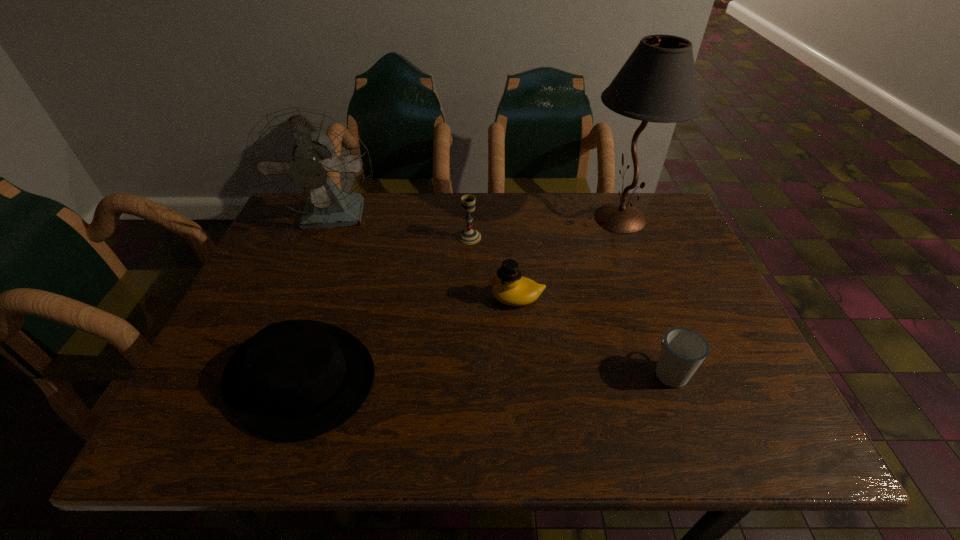
Find the location of `fan that is positioned at the far edge`. fan that is positioned at the far edge is located at coordinates (307, 160).

Find the location of `chalice that is at the far edge`. chalice that is at the far edge is located at coordinates (468, 236).

You are a GUI agent. You are given a task and a screenshot of the screen. Output one action in this format:
    pyautogui.click(x=<x>, y=<y>)
    Task: Click on the object that is at the near edge
    The height and width of the screenshot is (540, 960).
    Given the screenshot: What is the action you would take?
    pyautogui.click(x=295, y=379)

Image resolution: width=960 pixels, height=540 pixels. Identify the location of fan that is at the left edge. (307, 160).

Identify the location of fedora at the left edge. (295, 379).

Locate an element on the screen. The width and height of the screenshot is (960, 540). table lamp at the right edge is located at coordinates (658, 83).

Image resolution: width=960 pixels, height=540 pixels. I want to click on cup situated at the right edge, so click(x=683, y=350).

Locate an element on the screen. The height and width of the screenshot is (540, 960). object positioned at the far left corner is located at coordinates (307, 160).

I want to click on object at the near left corner, so point(295,379).

Locate an element on the screen. object present at the far right corner is located at coordinates (658, 83).